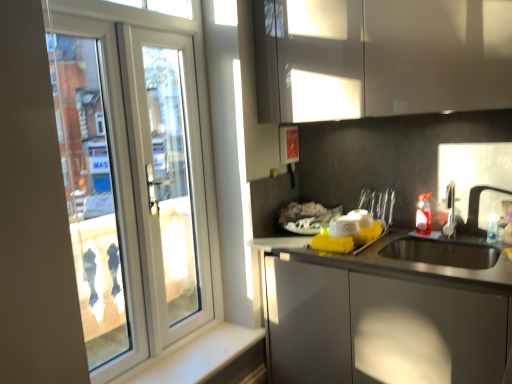
Question: Is white smooth window sill at lower left in front of glossy white cabinet at upper center?

Choices:
 (A) yes
 (B) no

Answer: (B)

Question: From the image's perspective, is white smooth window sill at lower left over glossy white cabinet at upper center?

Choices:
 (A) no
 (B) yes

Answer: (A)

Question: Is white smooth window sill at lower left further to camera compared to glossy white cabinet at upper center?

Choices:
 (A) yes
 (B) no

Answer: (A)

Question: Is white smooth window sill at lower left shorter than glossy white cabinet at upper center?

Choices:
 (A) yes
 (B) no

Answer: (A)

Question: Does white smooth window sill at lower left appear on the left side of glossy white cabinet at upper center?

Choices:
 (A) no
 (B) yes

Answer: (B)

Question: In terms of height, does white plastic screen door at left look taller or shorter compared to white smooth window sill at lower left?

Choices:
 (A) tall
 (B) short

Answer: (A)

Question: Considering the positions of white plastic screen door at left and white smooth window sill at lower left in the image, is white plastic screen door at left wider or thinner than white smooth window sill at lower left?

Choices:
 (A) thin
 (B) wide

Answer: (A)

Question: From the image's perspective, relative to white smooth window sill at lower left, is white plastic screen door at left above or below?

Choices:
 (A) above
 (B) below

Answer: (A)

Question: Considering the positions of white plastic screen door at left and white smooth window sill at lower left in the image, is white plastic screen door at left bigger or smaller than white smooth window sill at lower left?

Choices:
 (A) small
 (B) big

Answer: (B)

Question: Is white smooth window sill at lower left taller or shorter than glossy white cabinet at upper center?

Choices:
 (A) short
 (B) tall

Answer: (A)

Question: Is white smooth window sill at lower left bigger or smaller than glossy white cabinet at upper center?

Choices:
 (A) small
 (B) big

Answer: (A)

Question: Does point (175, 369) appear closer or farther from the camera than point (271, 38)?

Choices:
 (A) farther
 (B) closer

Answer: (B)

Question: Is white smooth window sill at lower left spatially inside glossy white cabinet at upper center, or outside of it?

Choices:
 (A) inside
 (B) outside

Answer: (B)

Question: From the image's perspective, is white plastic door at left located above or below glossy white cabinet at upper center?

Choices:
 (A) above
 (B) below

Answer: (B)

Question: From a real-world perspective, is white plastic door at left above or below glossy white cabinet at upper center?

Choices:
 (A) below
 (B) above

Answer: (A)